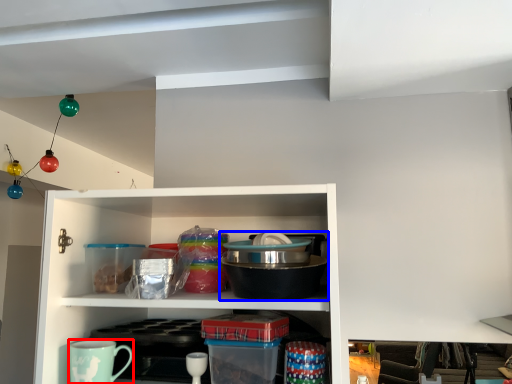
Question: Which object is closer to the camera taking this photo, coffee cup (highlighted by a red box) or appliance (highlighted by a blue box)?

Choices:
 (A) coffee cup
 (B) appliance

Answer: (B)